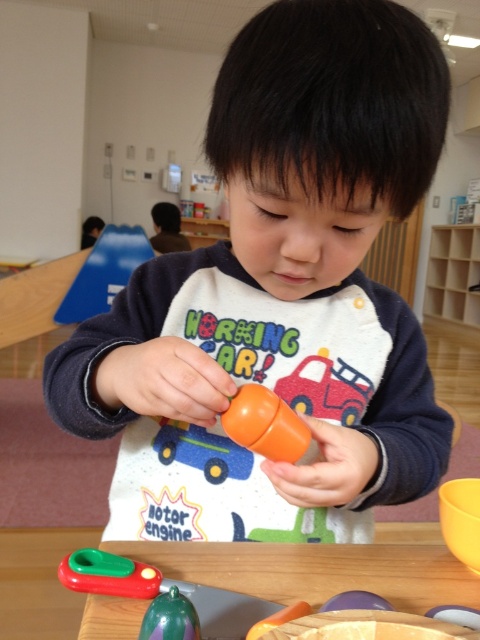
Question: Which point appears closest to the camera in this image?

Choices:
 (A) (63, 582)
 (B) (210, 442)
 (C) (241, 419)

Answer: (C)

Question: Is orange matte toy at center thinner than green rubber toy at center?

Choices:
 (A) yes
 (B) no

Answer: (B)

Question: Which point is closer to the camera?

Choices:
 (A) (175, 436)
 (B) (396, 627)
 (C) (267, 109)
 (D) (228, 420)

Answer: (B)

Question: Which of the following is the farthest from the observer?

Choices:
 (A) (168, 620)
 (B) (204, 444)

Answer: (B)

Question: Is the position of orange matte toy at center more distant than that of orange matte toy car at center?

Choices:
 (A) yes
 (B) no

Answer: (B)

Question: Does wooden table at center appear over orange matte toy car at center?

Choices:
 (A) no
 (B) yes

Answer: (A)